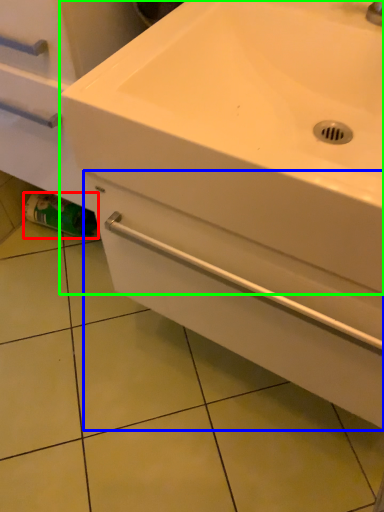
Question: Which is farther away from toilet paper (highlighted by a red box)? drawer (highlighted by a blue box) or sink (highlighted by a green box)?

Choices:
 (A) drawer
 (B) sink

Answer: (B)